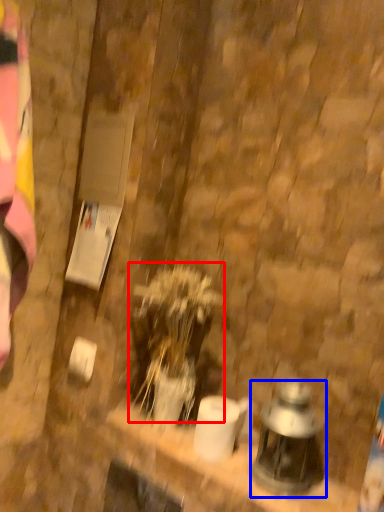
Question: Which object appears closest to the camera in this image, plant (highlighted by a red box) or lantern (highlighted by a blue box)?

Choices:
 (A) plant
 (B) lantern

Answer: (B)